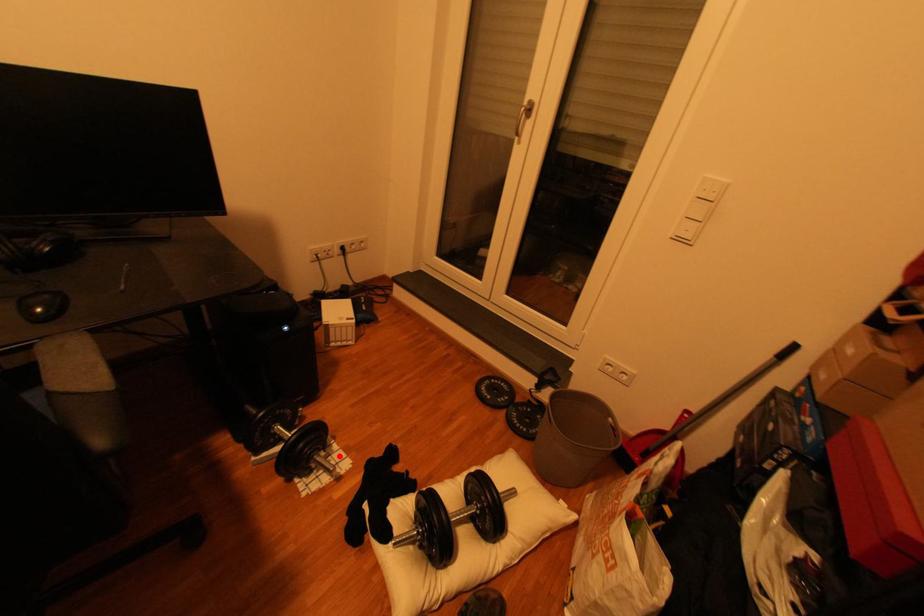
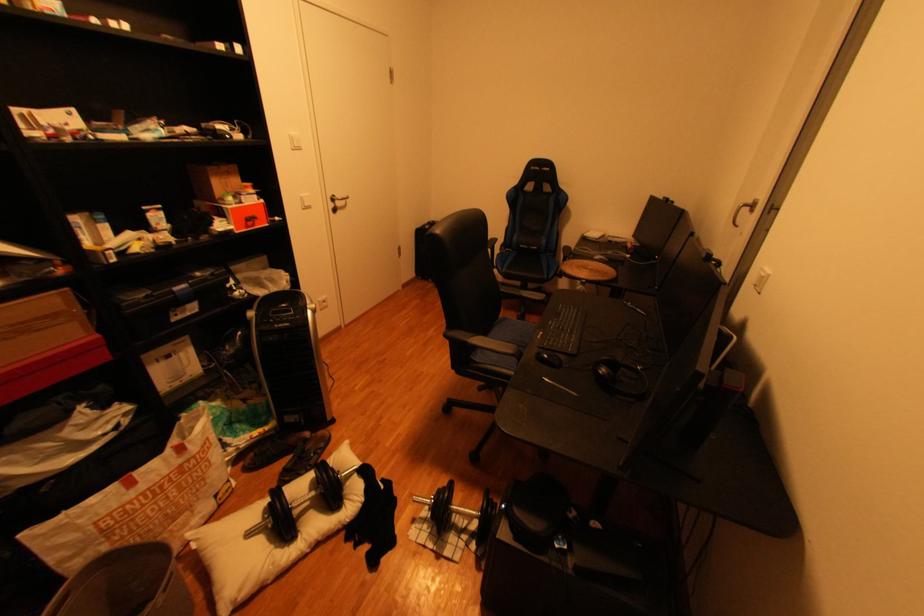
The point at the highlighted location is marked in the first image. Where is the corresponding point in the second image?

(440, 533)